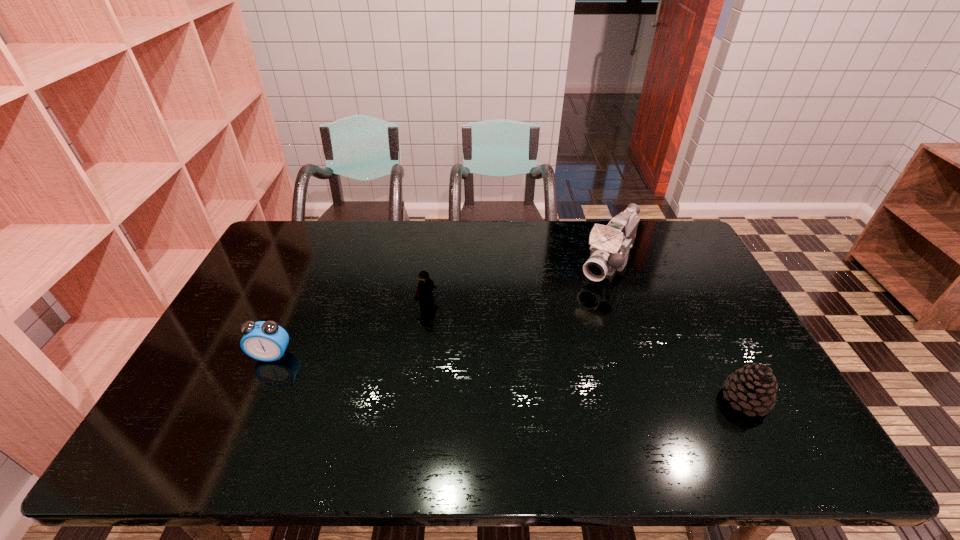
Where is `free space located on the front-facing side of the camcorder`? free space located on the front-facing side of the camcorder is located at coordinates (581, 310).

Where is `vacant space situated 0.140m on the front-facing side of the camcorder`? The width and height of the screenshot is (960, 540). vacant space situated 0.140m on the front-facing side of the camcorder is located at coordinates (579, 312).

This screenshot has height=540, width=960. Identify the location of free space located on the face of the third object from right to left. (499, 350).

The height and width of the screenshot is (540, 960). In order to click on free space located on the face of the third object from right to left in this screenshot , I will do `click(474, 334)`.

Locate an element on the screen. Image resolution: width=960 pixels, height=540 pixels. free space located on the face of the third object from right to left is located at coordinates (532, 371).

Find the location of a particular element. object located in the far edge section of the desktop is located at coordinates (610, 245).

The height and width of the screenshot is (540, 960). Identify the location of object located at the near edge. (753, 388).

This screenshot has height=540, width=960. In order to click on object located in the left edge section of the desktop in this screenshot , I will do `click(266, 341)`.

Locate an element on the screen. The image size is (960, 540). object present at the right edge is located at coordinates (753, 388).

Identify the location of object located in the near right corner section of the desktop. [x=753, y=388].